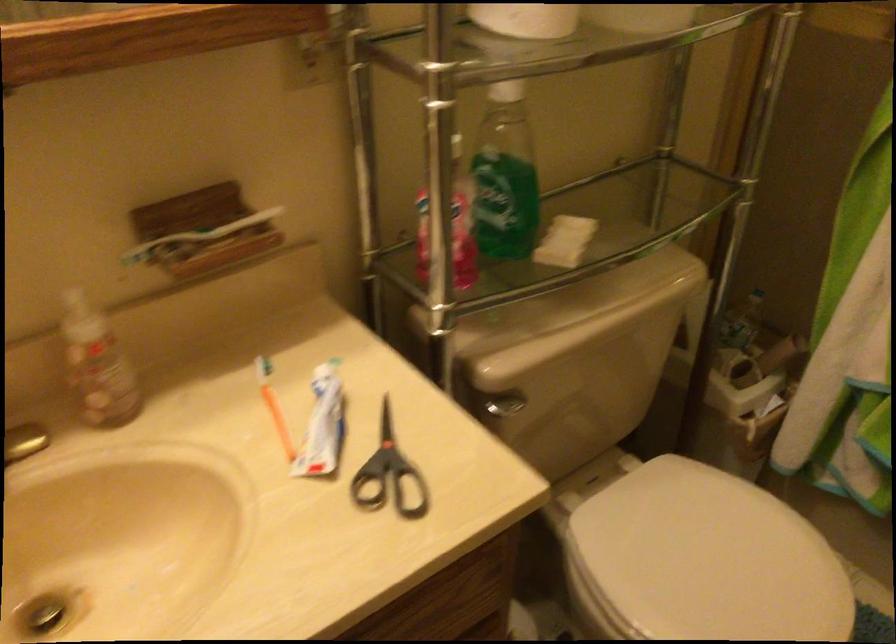
You are a GUI agent. You are given a task and a screenshot of the screen. Output one action in this format:
    pyautogui.click(x=<x>, y=<y>)
    Task: Click on the clear pump bottle
    
    Given the screenshot: What is the action you would take?
    pyautogui.click(x=97, y=364)